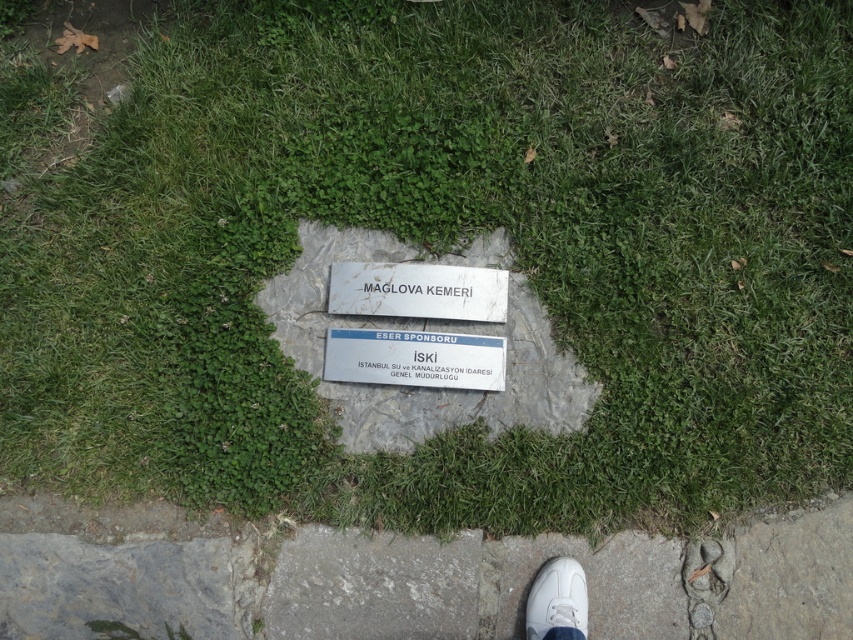
Between point (370, 294) and point (553, 572), which one is positioned behind?

Positioned behind is point (370, 294).

Find the location of `white stone plaque at center`. white stone plaque at center is located at coordinates (416, 291).

Can you confirm if gray concrete pavement at lower center is positioned to the right of white stone plaque at center?

Correct, you'll find gray concrete pavement at lower center to the right of white stone plaque at center.

Can you confirm if gray concrete pavement at lower center is bigger than white stone plaque at center?

Yes.

Does point (358, 634) come closer to viewer compared to point (437, 276)?

Yes, it is.

Where is `gray concrete pavement at lower center`? Image resolution: width=853 pixels, height=640 pixels. gray concrete pavement at lower center is located at coordinates (311, 579).

How distant is white plastic sign at center from white stone plaque at center?

They are 4.62 inches apart.

Is white plastic sign at center bigger than white stone plaque at center?

Incorrect, white plastic sign at center is not larger than white stone plaque at center.

Does point (456, 348) lie behind point (347, 291)?

No.

Identify the location of white plastic sign at center. This screenshot has height=640, width=853. (415, 358).